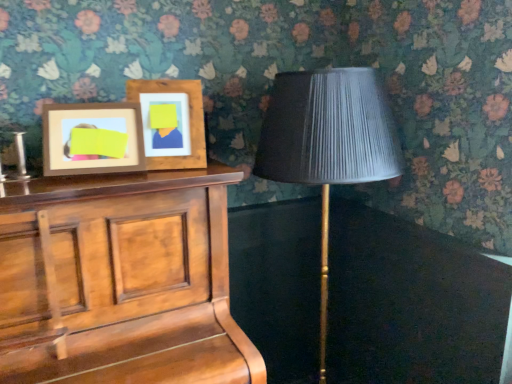
At what (x,y) coordinates should I click in order to perform the action: click on free location to the right of wooden picture frame at upper left, acting as the 2th picture frame starting from the right. Please return your answer as a coordinate pair (x, y). This screenshot has width=512, height=384. Looking at the image, I should click on (165, 177).